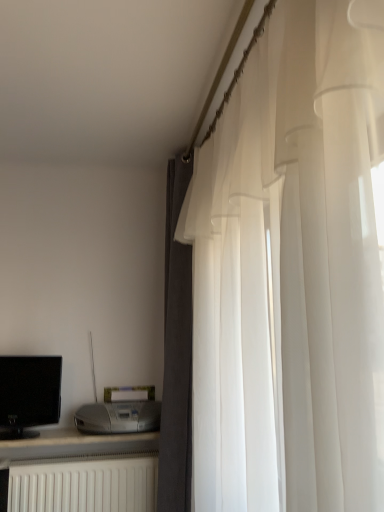
Question: Looking at the image, does black glossy computer monitor at left seem bigger or smaller compared to satin silver printer at lower left?

Choices:
 (A) big
 (B) small

Answer: (B)

Question: From a real-world perspective, is black glossy computer monitor at left positioned above or below satin silver printer at lower left?

Choices:
 (A) below
 (B) above

Answer: (B)

Question: Which is nearer to the black glossy computer monitor at left?

Choices:
 (A) dark gray fabric curtain at right, the second curtain when ordered from front to back
 (B) white matte radiator at lower left
 (C) satin silver printer at lower left
 (D) white sheer curtain at right, arranged as the second curtain when viewed from the back

Answer: (C)

Question: Which is nearer to the white sheer curtain at right, arranged as the second curtain when viewed from the back?

Choices:
 (A) satin silver printer at lower left
 (B) dark gray fabric curtain at right, the second curtain when ordered from front to back
 (C) black glossy computer monitor at left
 (D) white matte radiator at lower left

Answer: (B)